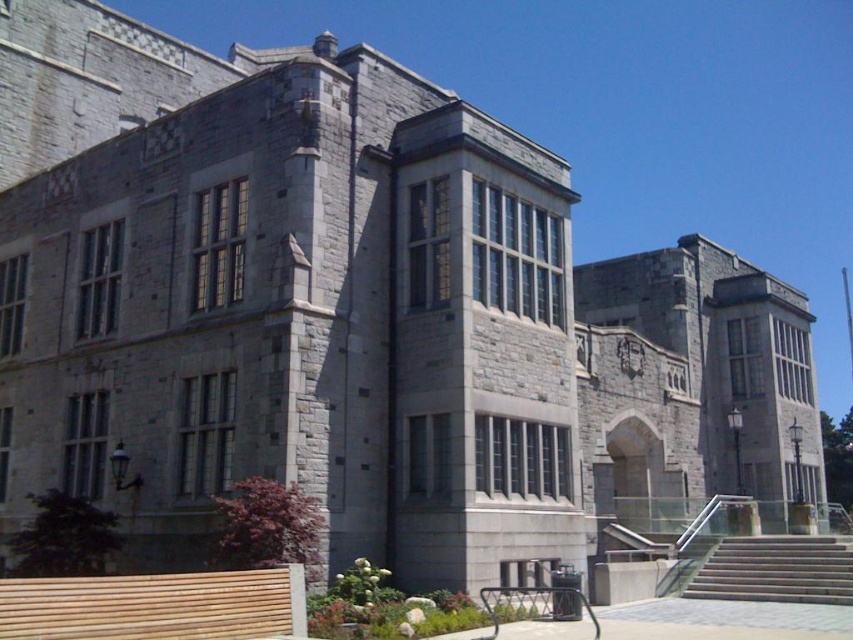
Based on the photo, is light brown wooden park bench at lower left to the left of concrete stairs at lower right from the viewer's perspective?

Indeed, light brown wooden park bench at lower left is positioned on the left side of concrete stairs at lower right.

Describe the element at coordinates (155, 605) in the screenshot. I see `light brown wooden park bench at lower left` at that location.

This screenshot has width=853, height=640. What do you see at coordinates (155, 605) in the screenshot? I see `light brown wooden park bench at lower left` at bounding box center [155, 605].

This screenshot has width=853, height=640. Identify the location of light brown wooden park bench at lower left. (155, 605).